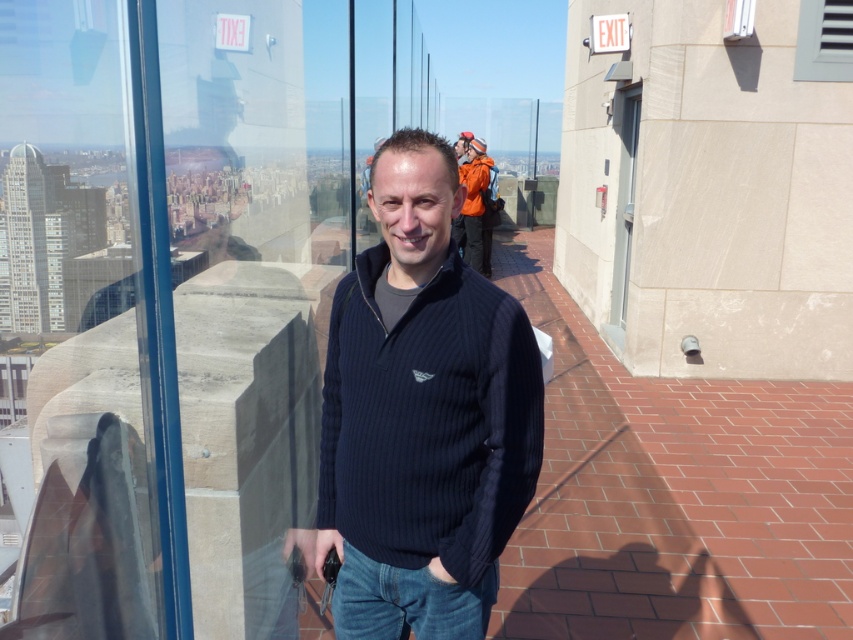
You are an architect reviewing the rooftop design. You notice the gray matte vent at upper right and the clear glass window at upper right. Which one has a larger surface area according to the design specifications?

The gray matte vent at upper right has a larger surface area than the clear glass window at upper right according to the design specifications.

You are a fashion designer observing the man in the scene. You need to determine if the black ribbed sweater at center can be worn with the gray matte vent at upper right without looking disproportionate. Based on their sizes, what would you advise?

The black ribbed sweater at center has a larger width than the gray matte vent at upper right, so the combination might appear disproportionate. Consider adjusting the vent size or choosing a narrower sweater for a balanced look.